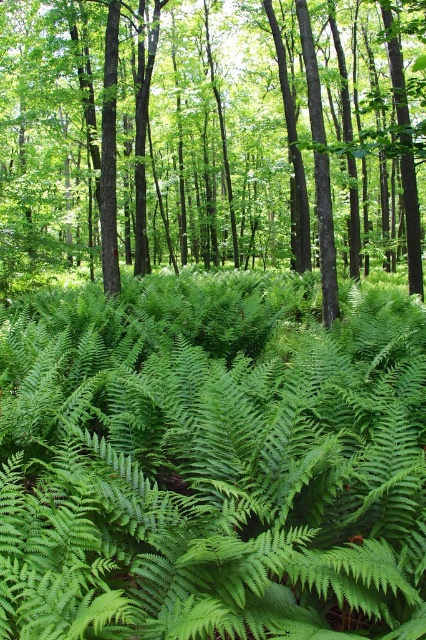
You are a hiker who wants to take a photo of the green leafy fern at center and the green leafy fern at lower center. Which fern should you focus on first to ensure both are in focus?

You should focus on the green leafy fern at center first because it is closer to you than the green leafy fern at lower center, so adjusting focus from near to far will help both be in focus.

You are standing in the forest and want to place a small marker exactly at the center of the image. The green leafy fern at center is located at coordinate point 0.723, 0.498. Is the fern positioned to the left or right of the center point of the image?

The green leafy fern at center is located at coordinate point (212, 461). Since the x coordinate 0.723 is greater than 0.5, it is positioned to the right of the center point of the image.

You are a botanist studying ferns in this forest. You observe two ferns labeled as green leafy fern at center and green leafy fern at lower center. Which fern is shorter?

The green leafy fern at center is shorter than the green leafy fern at lower center.